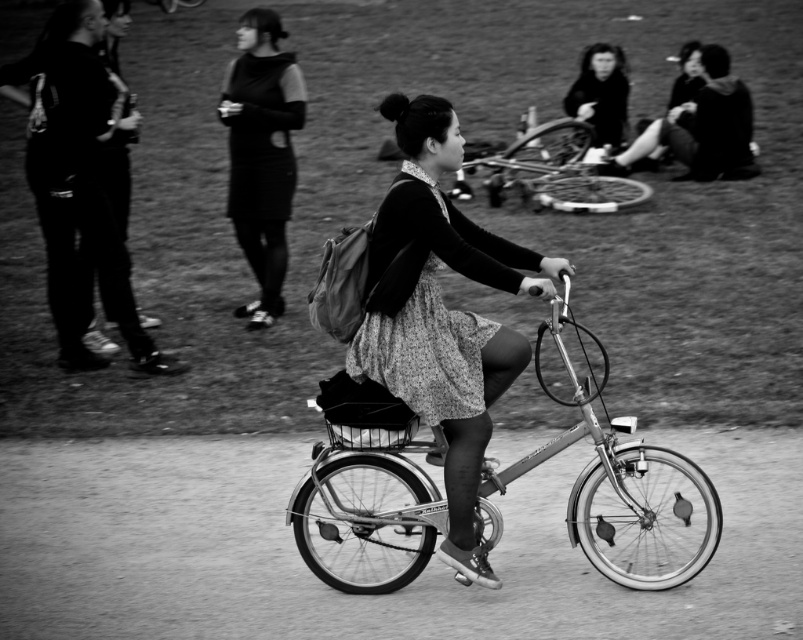
You are standing at the point marked by the coordinates point (441, 314) in the image. What object is located exactly at that point?

The point (441, 314) marks the location of the floral dress at center.